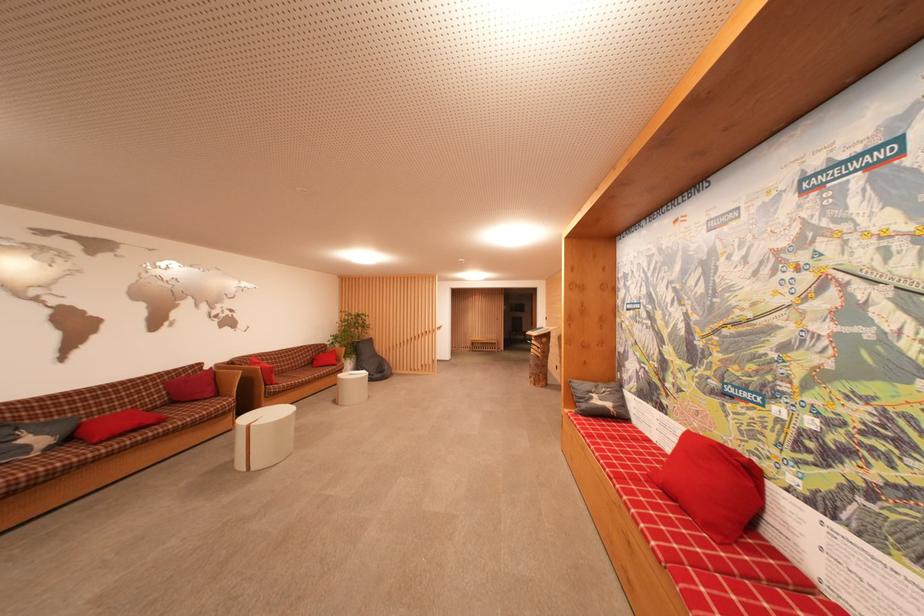
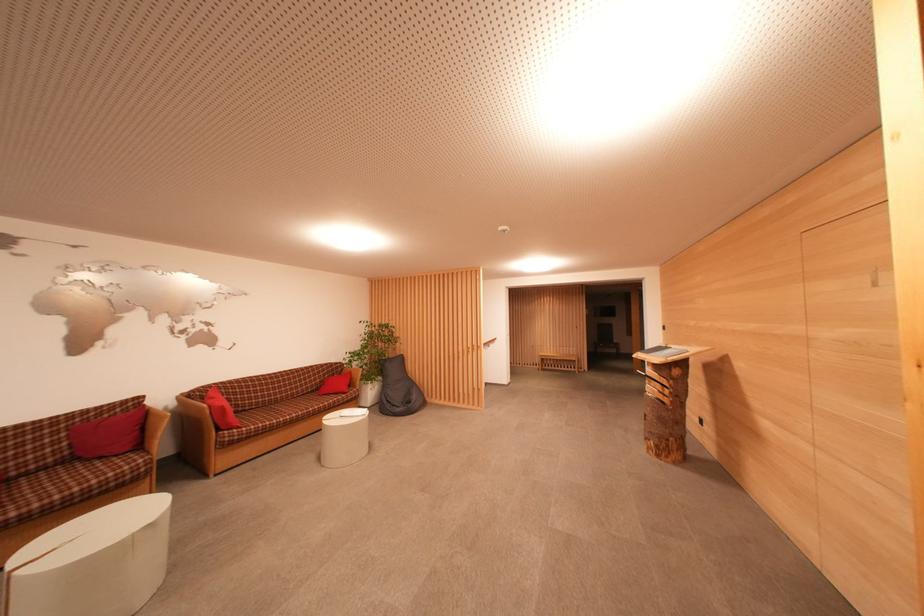
The point at (371, 339) is marked in the first image. Where is the corresponding point in the second image?

(402, 357)